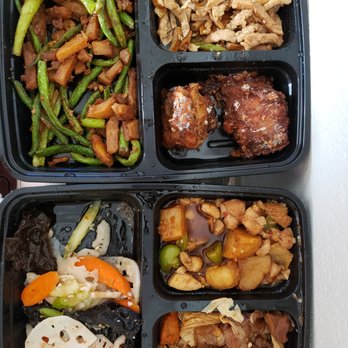
In order to click on rim of trays in this screenshot , I will do `click(308, 85)`, `click(305, 274)`.